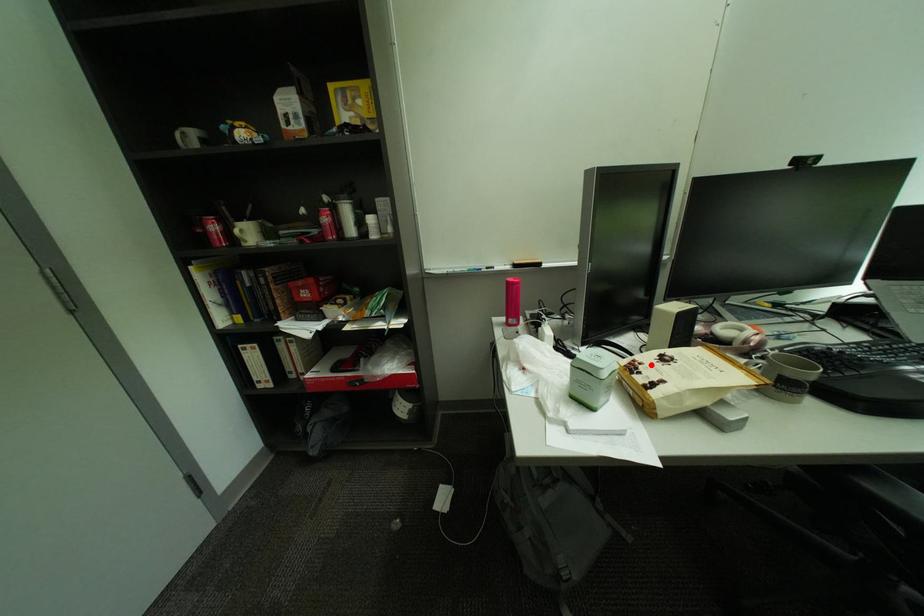
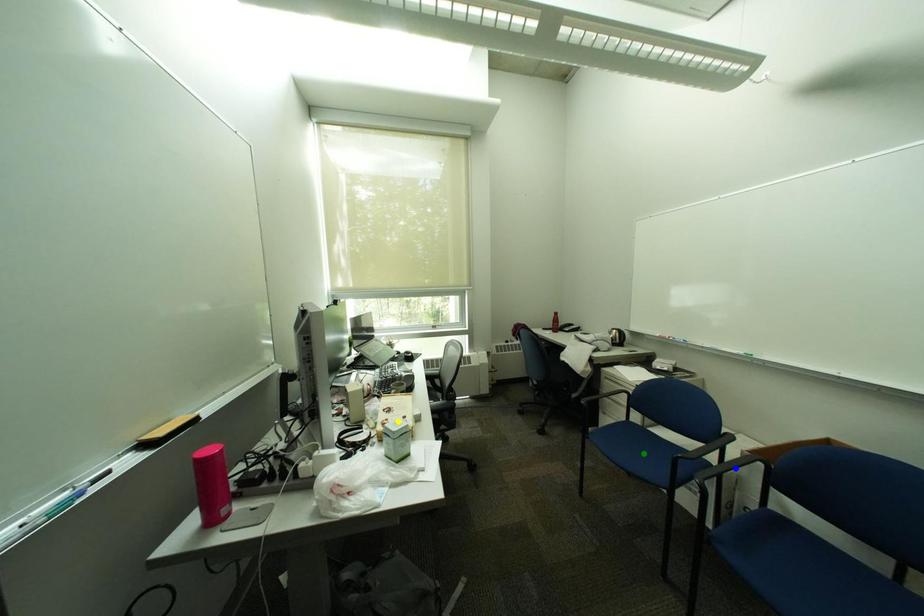
Question: I am providing you with two images of the same scene from different viewpoints. A red point is marked on the first image. You are given multiple points on the second image. Which point in image 2 is actually the same real-world point as the red point in image 1?

Choices:
 (A) blue point
 (B) green point
 (C) yellow point

Answer: (C)